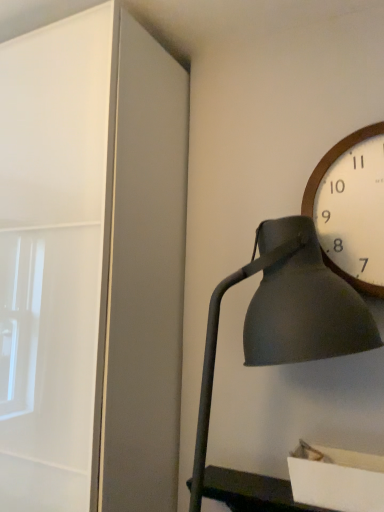
Locate an element on the screen. This screenshot has height=512, width=384. matte black lamp at right is located at coordinates (279, 345).

What do you see at coordinates (279, 345) in the screenshot?
I see `matte black lamp at right` at bounding box center [279, 345].

Identify the location of wooden/textured wall clock at upper right. [352, 207].

Describe the element at coordinates (352, 207) in the screenshot. This screenshot has height=512, width=384. I see `wooden/textured wall clock at upper right` at that location.

At what (x,y) coordinates should I click in order to perform the action: click on matte black lamp at right. Please return your answer as a coordinate pair (x, y). The image size is (384, 512). Looking at the image, I should click on (279, 345).

Considering the relative positions of wooden/textured wall clock at upper right and matte black lamp at right in the image provided, is wooden/textured wall clock at upper right to the right of matte black lamp at right from the viewer's perspective?

Yes.

Considering their positions, is wooden/textured wall clock at upper right located in front of or behind matte black lamp at right?

In the image, wooden/textured wall clock at upper right appears behind matte black lamp at right.

Does point (380, 226) come farther from viewer compared to point (248, 362)?

Yes, it is.

From the image's perspective, is wooden/textured wall clock at upper right below matte black lamp at right?

No, from the image's perspective, wooden/textured wall clock at upper right is not beneath matte black lamp at right.

From a real-world perspective, relative to matte black lamp at right, is wooden/textured wall clock at upper right vertically above or below?

Clearly, from a real-world perspective, wooden/textured wall clock at upper right is above matte black lamp at right.

In terms of width, does wooden/textured wall clock at upper right look wider or thinner when compared to matte black lamp at right?

Considering their sizes, wooden/textured wall clock at upper right looks slimmer than matte black lamp at right.

From their relative heights in the image, would you say wooden/textured wall clock at upper right is taller or shorter than matte black lamp at right?

In the image, wooden/textured wall clock at upper right appears to be shorter than matte black lamp at right.

Between wooden/textured wall clock at upper right and matte black lamp at right, which one has smaller size?

wooden/textured wall clock at upper right.

Do you think wooden/textured wall clock at upper right is within matte black lamp at right, or outside of it?

wooden/textured wall clock at upper right is located beyond the bounds of matte black lamp at right.

Does wooden/textured wall clock at upper right touch matte black lamp at right?

wooden/textured wall clock at upper right is not next to matte black lamp at right, and they're not touching.

Is wooden/textured wall clock at upper right turned away from matte black lamp at right?

That's not correct — wooden/textured wall clock at upper right is not looking away from matte black lamp at right.

Find the location of `wall clock on the right side of matte black lamp at right`. wall clock on the right side of matte black lamp at right is located at coordinates (352, 207).

Would you say matte black lamp at right is to the left or to the right of wooden/textured wall clock at upper right in the picture?

Clearly, matte black lamp at right is on the left of wooden/textured wall clock at upper right in the image.

Between matte black lamp at right and wooden/textured wall clock at upper right, which one is positioned behind?

Positioned behind is wooden/textured wall clock at upper right.

Is point (271, 346) positioned behind point (366, 233)?

No.

From the image's perspective, is matte black lamp at right on wooden/textured wall clock at upper right?

No.

From a real-world perspective, who is located lower, matte black lamp at right or wooden/textured wall clock at upper right?

matte black lamp at right is physically lower.

Based on the photo, is matte black lamp at right wider or thinner than wooden/textured wall clock at upper right?

Clearly, matte black lamp at right has more width compared to wooden/textured wall clock at upper right.

Which of these two, matte black lamp at right or wooden/textured wall clock at upper right, stands shorter?

With less height is wooden/textured wall clock at upper right.

Who is smaller, matte black lamp at right or wooden/textured wall clock at upper right?

wooden/textured wall clock at upper right is smaller.

Is matte black lamp at right situated inside wooden/textured wall clock at upper right or outside?

matte black lamp at right is not enclosed by wooden/textured wall clock at upper right.

Is matte black lamp at right with wooden/textured wall clock at upper right?

No.

Is matte black lamp at right turned away from wooden/textured wall clock at upper right?

No.

How different are the orientations of matte black lamp at right and wooden/textured wall clock at upper right in degrees?

matte black lamp at right and wooden/textured wall clock at upper right are facing 0.315 degrees away from each other.

How far apart are matte black lamp at right and wooden/textured wall clock at upper right?

matte black lamp at right is 25.07 centimeters from wooden/textured wall clock at upper right.

What are the coordinates of `wall clock above the matte black lamp at right (from a real-world perspective)` in the screenshot? It's located at (352, 207).

You are a GUI agent. You are given a task and a screenshot of the screen. Output one action in this format:
    pyautogui.click(x=<x>, y=<y>)
    Task: Click on the wall clock above the matte black lamp at right (from the image's perspective)
    The height and width of the screenshot is (512, 384).
    Given the screenshot: What is the action you would take?
    pyautogui.click(x=352, y=207)

At what (x,y) coordinates should I click in order to perform the action: click on lamp below the wooden/textured wall clock at upper right (from the image's perspective). Please return your answer as a coordinate pair (x, y). The image size is (384, 512). Looking at the image, I should click on (279, 345).